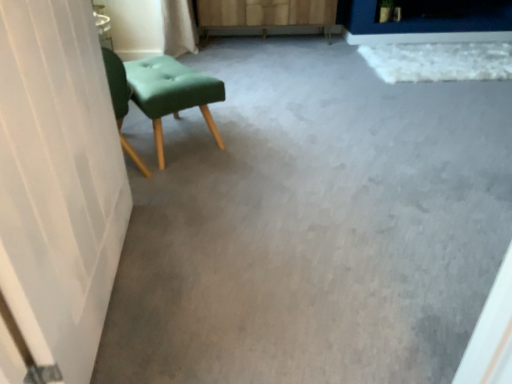
Question: Is matte green fabric stool at left not near matte gray carpet at center?

Choices:
 (A) no
 (B) yes

Answer: (A)

Question: Does matte green fabric stool at left come behind matte gray carpet at center?

Choices:
 (A) no
 (B) yes

Answer: (B)

Question: Considering the relative sizes of matte green fabric stool at left and matte gray carpet at center in the image provided, is matte green fabric stool at left wider than matte gray carpet at center?

Choices:
 (A) yes
 (B) no

Answer: (B)

Question: Does matte green fabric stool at left have a lesser width compared to matte gray carpet at center?

Choices:
 (A) no
 (B) yes

Answer: (B)

Question: Is matte green fabric stool at left turned away from matte gray carpet at center?

Choices:
 (A) yes
 (B) no

Answer: (B)

Question: Is wooden dresser at center to the left or to the right of matte green fabric stool at left in the image?

Choices:
 (A) left
 (B) right

Answer: (B)

Question: Considering their positions, is wooden dresser at center located in front of or behind matte green fabric stool at left?

Choices:
 (A) front
 (B) behind

Answer: (B)

Question: Based on their sizes in the image, would you say wooden dresser at center is bigger or smaller than matte green fabric stool at left?

Choices:
 (A) small
 (B) big

Answer: (B)

Question: Is wooden dresser at center inside the boundaries of matte green fabric stool at left, or outside?

Choices:
 (A) outside
 (B) inside

Answer: (A)

Question: Considering the positions of matte green fabric stool at left and matte gray carpet at center in the image, is matte green fabric stool at left wider or thinner than matte gray carpet at center?

Choices:
 (A) wide
 (B) thin

Answer: (B)

Question: Is matte green fabric stool at left situated inside matte gray carpet at center or outside?

Choices:
 (A) inside
 (B) outside

Answer: (B)

Question: Is matte green fabric stool at left in front of or behind matte gray carpet at center in the image?

Choices:
 (A) behind
 (B) front

Answer: (A)

Question: From the image's perspective, is matte green fabric stool at left positioned above or below matte gray carpet at center?

Choices:
 (A) above
 (B) below

Answer: (B)

Question: From a real-world perspective, is matte gray carpet at center positioned above or below matte green fabric stool at left?

Choices:
 (A) above
 (B) below

Answer: (B)

Question: From the image's perspective, is matte gray carpet at center located above or below matte green fabric stool at left?

Choices:
 (A) below
 (B) above

Answer: (B)